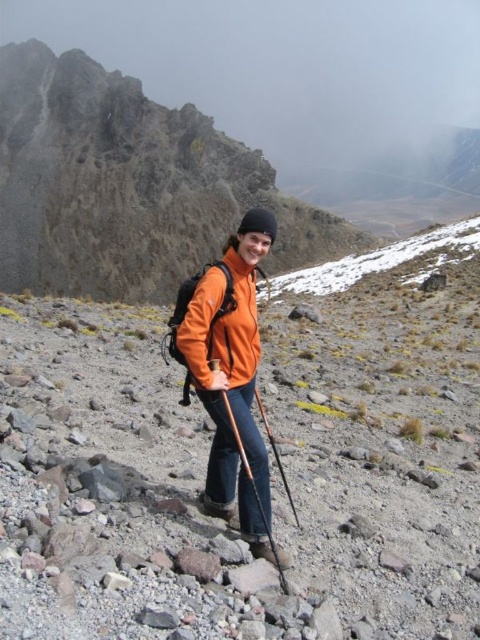
You are a hiker planning to take a photo of the orange matte jacket at center and the brown wood ski pole at center. Which object should you focus on first to ensure both are in the frame?

You should focus on the orange matte jacket at center first because the brown wood ski pole at center is behind it, so adjusting the frame to include the jacket ensures the pole behind it is also captured.

You are a hiker planning to take a photo of the rugged rock mountain at upper left and the orange matte jacket at center. Which object should you position to the left side of your camera frame?

You should position the rugged rock mountain at upper left to the left side of your camera frame since it is already located to the left of the orange matte jacket at center.

You are a photographer planning to take a photo of the orange softshell jacket at center from your camera. The jacket is 9.41 meters away. If your camera has a maximum focus range of 10 meters, will you be able to capture the jacket in focus?

The orange softshell jacket at center is 9.41 meters away from the camera. Since the camera can focus up to 10 meters, you can capture the jacket in focus as the distance is within the camera s maximum focus range.